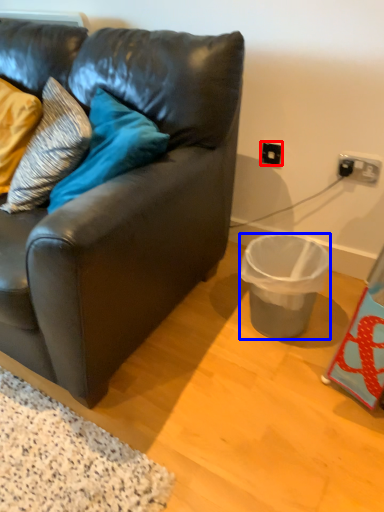
Question: Which point is further to the camera, electric outlet (highlighted by a red box) or trash bin/can (highlighted by a blue box)?

Choices:
 (A) electric outlet
 (B) trash bin/can

Answer: (A)